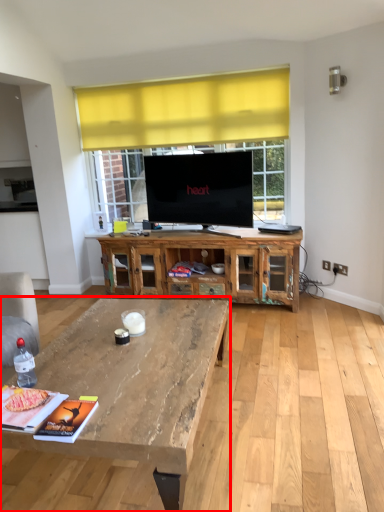
Question: From the image's perspective, considering the relative positions of coffee table (annotated by the red box) and cabinetry in the image provided, where is coffee table (annotated by the red box) located with respect to the staircase?

Choices:
 (A) above
 (B) below

Answer: (B)